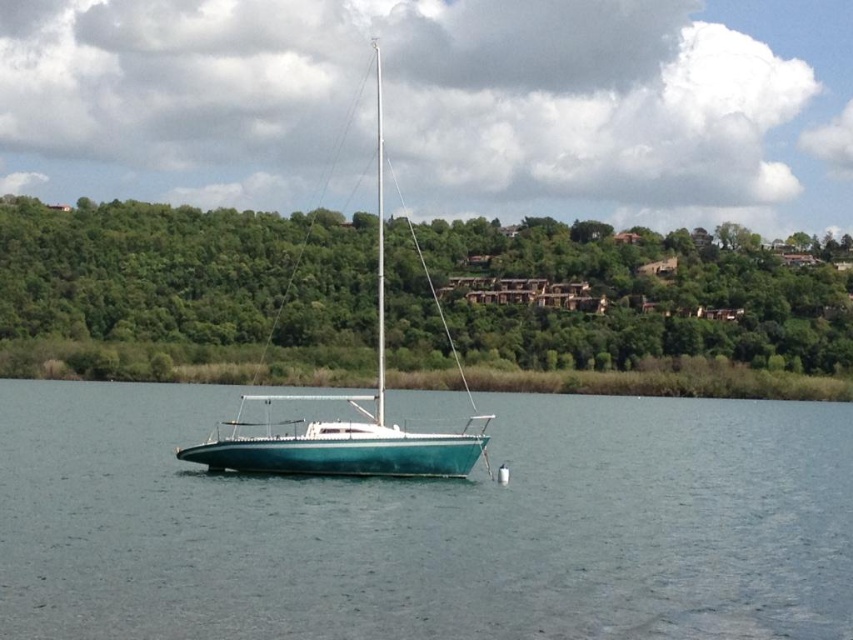
Question: Estimate the real-world distances between objects in this image. Which object is closer to the teal glossy water at center?

Choices:
 (A) teal glossy sailboat at center
 (B) green leafy trees at upper center

Answer: (A)

Question: Can you confirm if teal glossy water at center is wider than green leafy trees at upper center?

Choices:
 (A) no
 (B) yes

Answer: (A)

Question: Which of these objects is positioned farthest from the green leafy trees at upper center?

Choices:
 (A) teal glossy sailboat at center
 (B) teal glossy water at center

Answer: (B)

Question: Does teal glossy water at center come behind green leafy trees at upper center?

Choices:
 (A) yes
 (B) no

Answer: (B)

Question: Does green leafy trees at upper center have a larger size compared to teal glossy sailboat at center?

Choices:
 (A) yes
 (B) no

Answer: (A)

Question: Which object is closer to the camera taking this photo?

Choices:
 (A) green leafy trees at upper center
 (B) teal glossy sailboat at center
 (C) teal glossy water at center

Answer: (C)